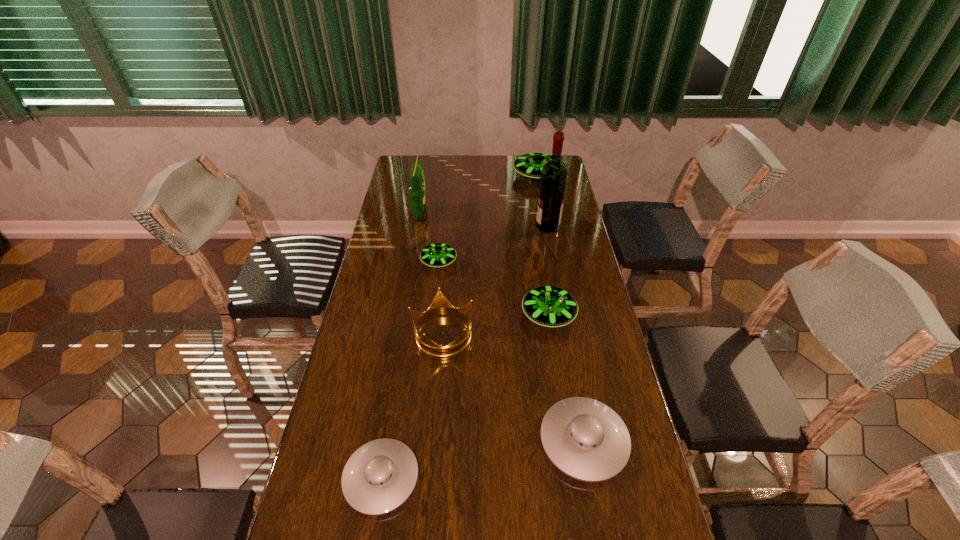
You are a GUI agent. You are given a task and a screenshot of the screen. Output one action in this format:
    pyautogui.click(x=<x>, y=<y>)
    Task: Click on the free space at the right edge
    The image size is (960, 540).
    Given the screenshot: What is the action you would take?
    pyautogui.click(x=568, y=214)

Where is `free space at the far left corner`? The image size is (960, 540). free space at the far left corner is located at coordinates (427, 162).

Identify the location of free spot between the leftmost green saucer and the fifth tallest object. click(493, 289).

This screenshot has width=960, height=540. I want to click on empty space between the left gray saucer and the tallest saucer, so click(x=459, y=327).

Find the location of a particular element. The height and width of the screenshot is (540, 960). vacant area between the right gray saucer and the green crisp (potato chip) is located at coordinates (502, 327).

This screenshot has height=540, width=960. What are the coordinates of `vacant area that lies between the alcohol and the gold crown` in the screenshot? It's located at (495, 280).

The image size is (960, 540). Identify the location of empty space that is in between the farthest green saucer and the gold crown. (490, 255).

At what (x,y) coordinates should I click in order to perform the action: click on vacant region between the second tallest saucer and the fourth farthest object. Please return your answer as a coordinate pair (x, y). Image resolution: width=960 pixels, height=540 pixels. Looking at the image, I should click on (493, 289).

In order to click on free space between the nearest green saucer and the left gray saucer in this screenshot , I will do `click(465, 397)`.

Select which object appears as the fifth closest to the gold crown. Please provide its 2D coordinates. Your answer should be formatted as a tuple, i.e. [(x, y)], where the tuple contains the x and y coordinates of a point satisfying the conditions above.

[(417, 190)]